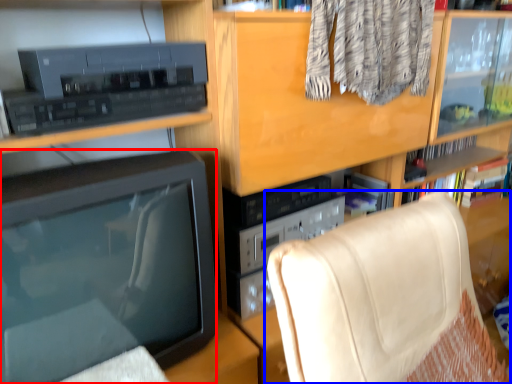
Question: Which of the following is the farthest to the observer, television (highlighted by a red box) or furniture (highlighted by a blue box)?

Choices:
 (A) television
 (B) furniture

Answer: (A)